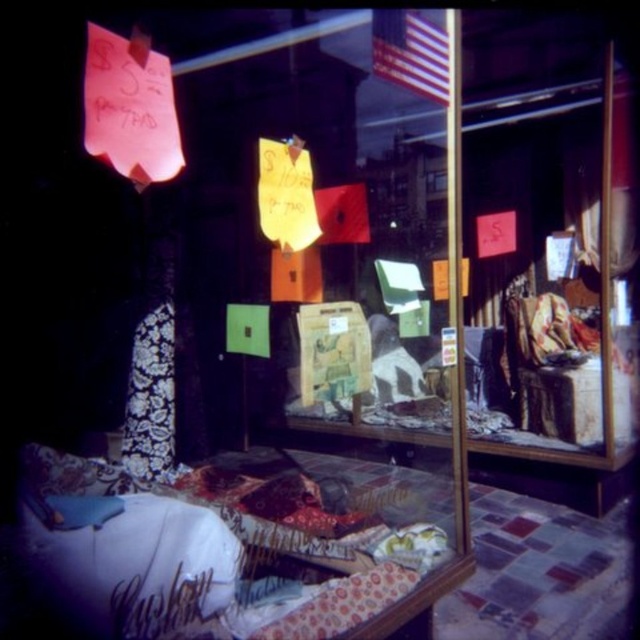
You are a customer in the store and want to grab both the silver metallic script at lower left and the red fabric flag at center. Which item should you reach for first if you want to pick up the one closer to your right hand?

The red fabric flag at center is positioned to the right of the silver metallic script at lower left, so you should reach for the red fabric flag at center first if you want to pick up the one closer to your right hand.

You are a customer in a thrift store and want to buy both the american flag at upper center and the silver metallic script at lower left. The store has a policy that if one item is wider than the other, you must place the wider item first in your cart. Which item should you place first in your cart?

The american flag at upper center should be placed first in your cart because its width surpasses that of the silver metallic script at lower left.